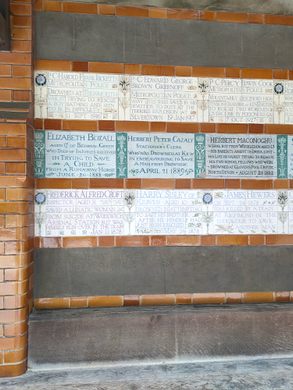
Locate an element on the screen. brick wall is located at coordinates (11, 226), (3, 168), (20, 24), (28, 274).